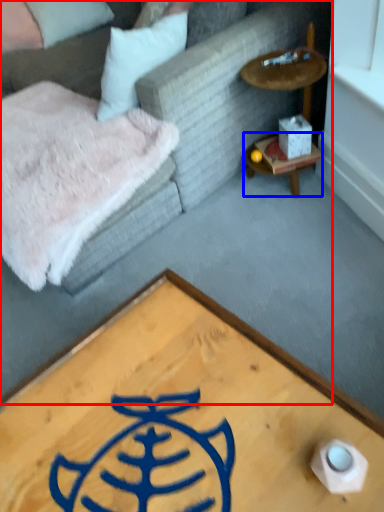
Question: Among these objects, which one is farthest to the camera, studio couch (highlighted by a red box) or table (highlighted by a blue box)?

Choices:
 (A) studio couch
 (B) table

Answer: (B)